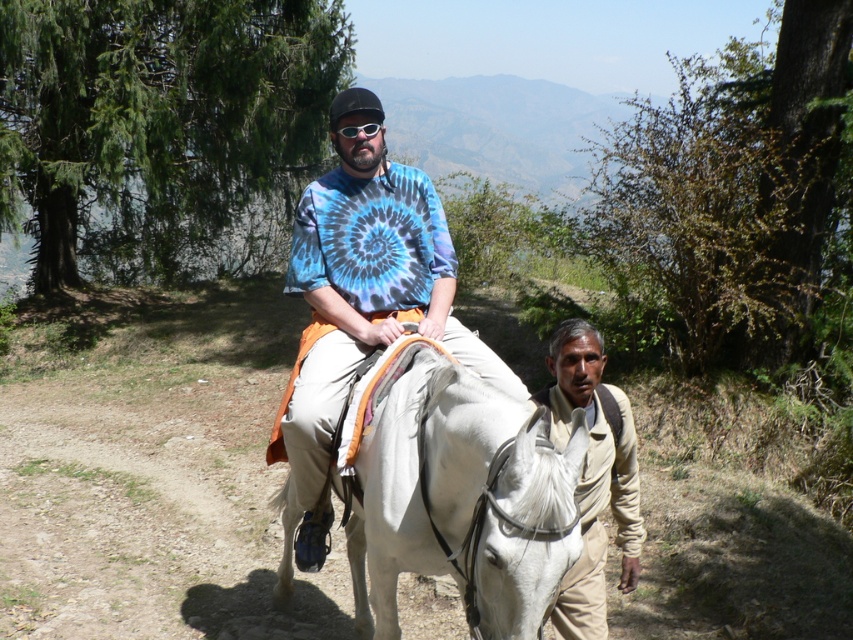
Question: Is white glossy horse at center to the right of tie-dye fabric shirt at center from the viewer's perspective?

Choices:
 (A) yes
 (B) no

Answer: (A)

Question: Is tie-dye fabric shirt at center to the right of beige cotton shirt at lower right from the viewer's perspective?

Choices:
 (A) no
 (B) yes

Answer: (A)

Question: Which point appears farthest from the camera in this image?

Choices:
 (A) (596, 499)
 (B) (292, 276)

Answer: (B)

Question: Does tie-dye fabric shirt at center have a larger size compared to beige cotton shirt at lower right?

Choices:
 (A) yes
 (B) no

Answer: (A)

Question: Which of the following is the farthest from the observer?

Choices:
 (A) (572, 323)
 (B) (456, 547)

Answer: (A)

Question: Which point is farther from the camera taking this photo?

Choices:
 (A) (312, 332)
 (B) (596, 566)
 (C) (366, 378)

Answer: (A)